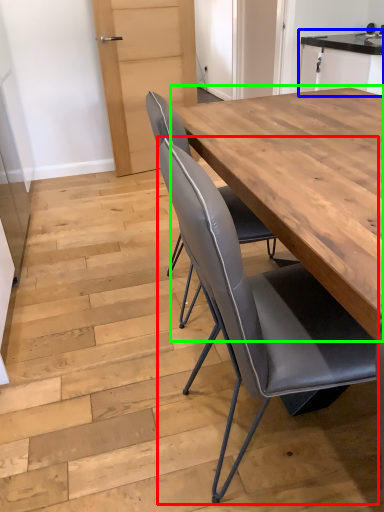
Question: Considering the real-world distances, which object is closest to chair (highlighted by a red box)? cabinetry (highlighted by a blue box) or table (highlighted by a green box).

Choices:
 (A) cabinetry
 (B) table

Answer: (B)